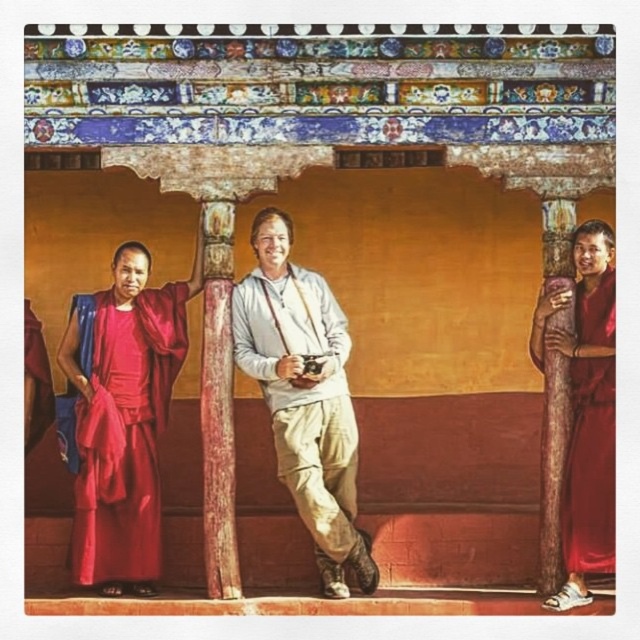
You are a photographer planning to capture a group photo of the matte gray shirt at center and the silky red robe at right. Since the two subjects are layered, which one should you focus on to ensure the other remains in the background?

The matte gray shirt at center is positioned over the silky red robe at right, so you should focus on the matte gray shirt at center to keep the silky red robe at right in the background.

You are a photographer planning to take a group photo of the matte gray shirt at center and the silky red robe at right. To ensure both subjects are in frame, which direction should you position your camera relative to the archway?

The matte gray shirt at center is positioned on the left side of silky red robe at right, so the camera should be positioned to the left of the archway to include both subjects in the frame.

You are a photographer planning to take a group photo of the two people in the scene. The light gray cotton shirt at center and the silky red robe at right are overlapping. To ensure both are fully visible in the photo, which person should be moved forward slightly?

The silky red robe at right should be moved forward slightly because the light gray cotton shirt at center is positioned over it, causing the silky red robe at right to be partially hidden.